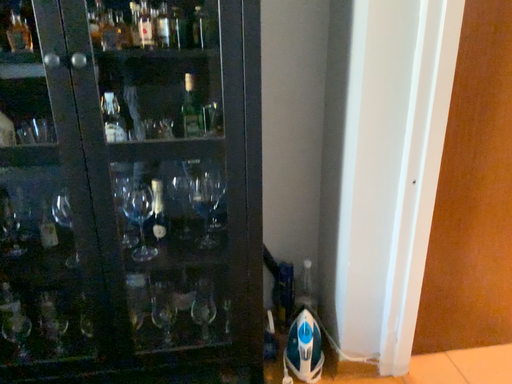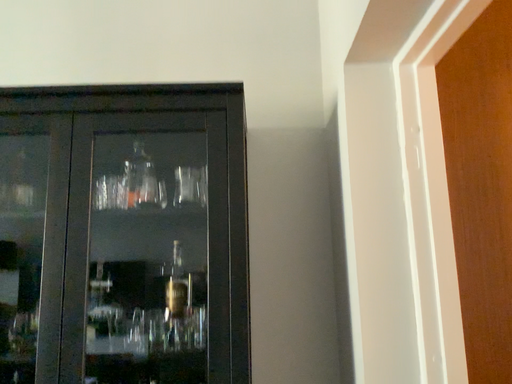
Question: Which way did the camera rotate in the video?

Choices:
 (A) rotated upward
 (B) rotated downward

Answer: (A)